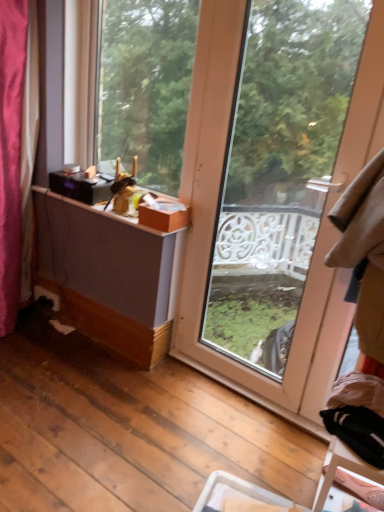
Question: Which direction should I rotate to look at transparent glass door at center, placed as the second window when sorted from left to right, — up or down?

Choices:
 (A) down
 (B) up

Answer: (B)

Question: Considering the relative sizes of transparent glass door at center, placed as the second window when sorted from left to right, and orange cardboard box at upper center in the image provided, is transparent glass door at center, placed as the second window when sorted from left to right, taller than orange cardboard box at upper center?

Choices:
 (A) no
 (B) yes

Answer: (B)

Question: Does transparent glass door at center, placed as the second window when sorted from left to right, have a lesser width compared to orange cardboard box at upper center?

Choices:
 (A) no
 (B) yes

Answer: (B)

Question: Does transparent glass door at center, placed as the second window when sorted from left to right, appear on the left side of orange cardboard box at upper center?

Choices:
 (A) no
 (B) yes

Answer: (A)

Question: Can you confirm if transparent glass door at center, placed as the second window when sorted from left to right, is bigger than orange cardboard box at upper center?

Choices:
 (A) no
 (B) yes

Answer: (B)

Question: Can orange cardboard box at upper center be found inside transparent glass door at center, placed as the second window when sorted from left to right?

Choices:
 (A) yes
 (B) no

Answer: (B)

Question: Is transparent glass door at center, placed as the second window when sorted from left to right, far away from orange cardboard box at upper center?

Choices:
 (A) no
 (B) yes

Answer: (A)

Question: Is transparent glass door at center, placed as the second window when sorted from left to right, not inside matte wood window at center, which ranks as the second window in right-to-left order?

Choices:
 (A) yes
 (B) no

Answer: (A)

Question: Considering the relative positions of transparent glass door at center, placed as the second window when sorted from left to right, and matte wood window at center, which ranks as the second window in right-to-left order, in the image provided, is transparent glass door at center, placed as the second window when sorted from left to right, in front of matte wood window at center, which ranks as the second window in right-to-left order,?

Choices:
 (A) yes
 (B) no

Answer: (A)

Question: Does transparent glass door at center, placed as the second window when sorted from left to right, have a lesser height compared to matte wood window at center, which ranks as the 1th window in left-to-right order?

Choices:
 (A) no
 (B) yes

Answer: (A)

Question: Considering the relative sizes of transparent glass door at center, the first window positioned from the right, and matte wood window at center, which ranks as the second window in right-to-left order, in the image provided, is transparent glass door at center, the first window positioned from the right, wider than matte wood window at center, which ranks as the second window in right-to-left order,?

Choices:
 (A) yes
 (B) no

Answer: (B)

Question: Does transparent glass door at center, the first window positioned from the right, come behind matte wood window at center, which ranks as the second window in right-to-left order?

Choices:
 (A) yes
 (B) no

Answer: (B)

Question: From a real-world perspective, is transparent glass door at center, placed as the second window when sorted from left to right, located higher than matte wood window at center, which ranks as the second window in right-to-left order?

Choices:
 (A) yes
 (B) no

Answer: (B)

Question: Does matte wood window at center, which ranks as the 1th window in left-to-right order, lie behind transparent glass door at center, the first window positioned from the right?

Choices:
 (A) yes
 (B) no

Answer: (A)